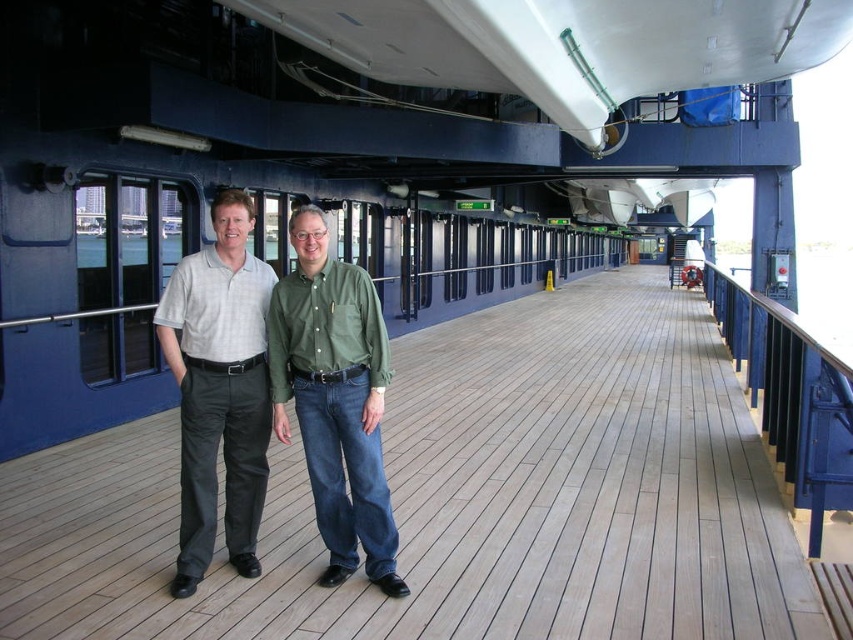
You are a photographer standing on the wooden deck of a ship. You want to take a photo of two points marked on the deck. The points are labeled as point 1 at coordinates point (416, 458) and point 2 at coordinates point (247, 488). To ensure both points are in focus, you need to know which point is closer to the camera. Which point is closer?

Point (416, 458) is further to the camera than point (247, 488), so point (247, 488) is closer to the camera and will be in focus first.

You are standing on the deck of a ship and see the wooden at center and the matte green shirt at center. Which object is closer to you?

The wooden at center is closer to you because it is in front of the matte green shirt at center.

You are standing on a wooden deck of a ship and see the matte green shirt at center and the gray cotton shirt at center. Which shirt is positioned lower in the image?

The matte green shirt at center is below the gray cotton shirt at center, so it is positioned lower in the image.